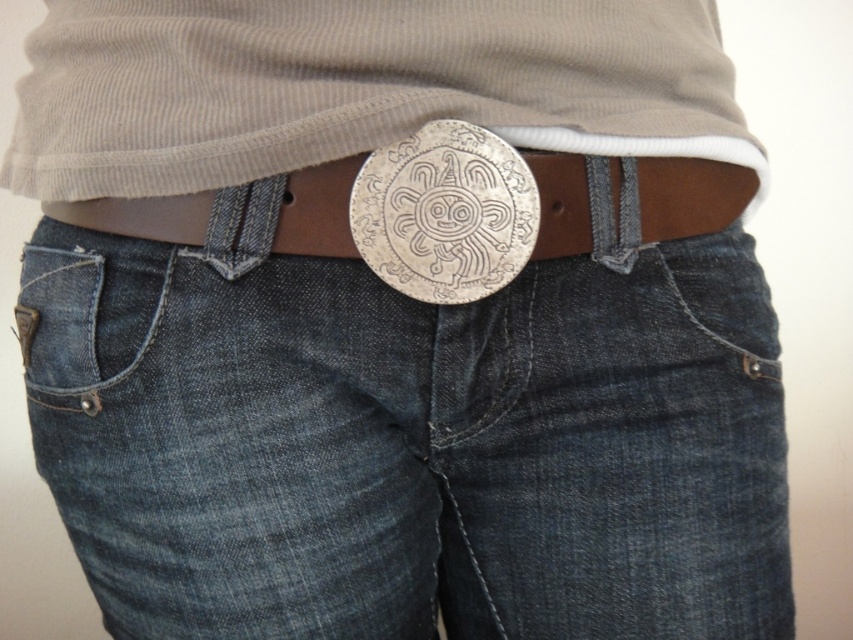
Which of these two, denim at center or denim pocket at lower left, stands shorter?

denim pocket at lower left

Who is more distant from viewer, (312, 372) or (161, 326)?

Point (312, 372)

Is point (489, 620) farther from viewer compared to point (135, 248)?

Yes, it is.

Where is `denim at center`? denim at center is located at coordinates (410, 444).

Between silver metallic buckle at center and denim pocket at lower left, which one has more height?

With more height is denim pocket at lower left.

Who is positioned more to the left, silver metallic buckle at center or denim pocket at lower left?

denim pocket at lower left is more to the left.

What are the coordinates of `silver metallic buckle at center` in the screenshot? It's located at (689, 195).

In order to click on silver metallic buckle at center in this screenshot , I will do `click(689, 195)`.

Is point (119, 314) in front of point (323, 228)?

No, it is not.

Does denim at center have a larger size compared to silver metallic buckle at center?

Indeed, denim at center has a larger size compared to silver metallic buckle at center.

Is point (123, 240) positioned before point (683, 218)?

That is True.

You are a GUI agent. You are given a task and a screenshot of the screen. Output one action in this format:
    pyautogui.click(x=<x>, y=<y>)
    Task: Click on the denim at center
    
    Given the screenshot: What is the action you would take?
    [x=410, y=444]